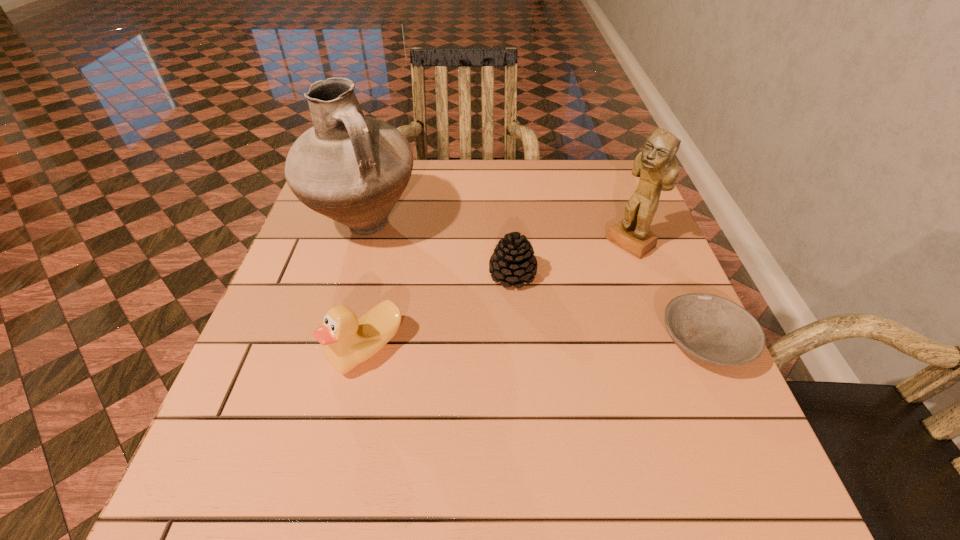
Locate which object is the second closest to the figurine. Please provide its 2D coordinates. Your answer should be formatted as a tuple, i.e. [(x, y)], where the tuple contains the x and y coordinates of a point satisfying the conditions above.

[(513, 261)]

Select which object is the second closest to the tallest object. Please provide its 2D coordinates. Your answer should be formatted as a tuple, i.e. [(x, y)], where the tuple contains the x and y coordinates of a point satisfying the conditions above.

[(513, 261)]

I want to click on free location that satisfies the following two spatial constraints: 1. on the front side of the third object from right to left; 2. on the left side of the pitcher, so click(349, 275).